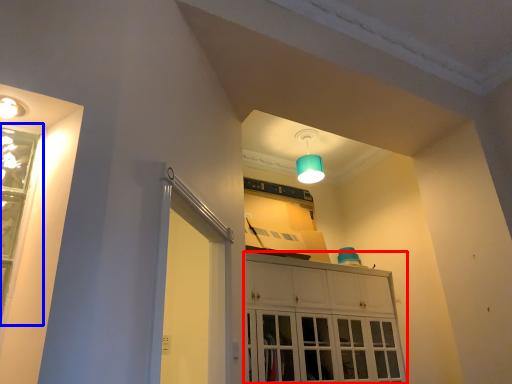
Question: Among these objects, which one is farthest to the camera, cabinetry (highlighted by a red box) or window (highlighted by a blue box)?

Choices:
 (A) cabinetry
 (B) window

Answer: (A)